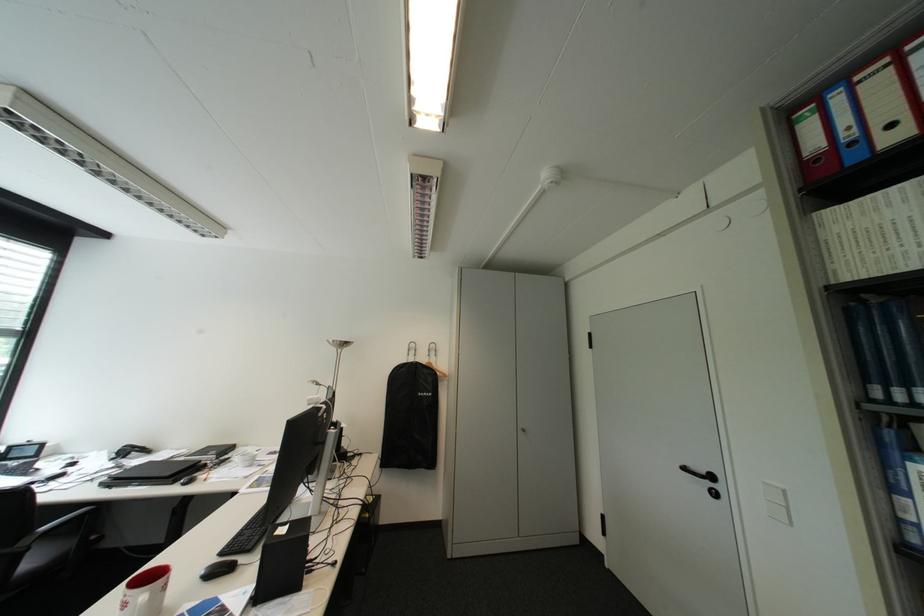
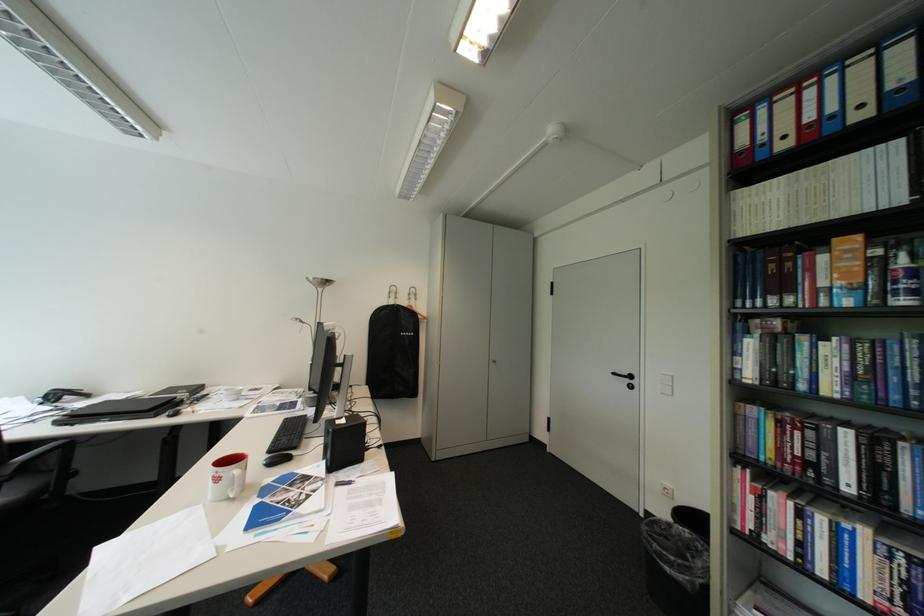
Find the pixel in the second image that matches [428,351] in the first image.

(408, 294)